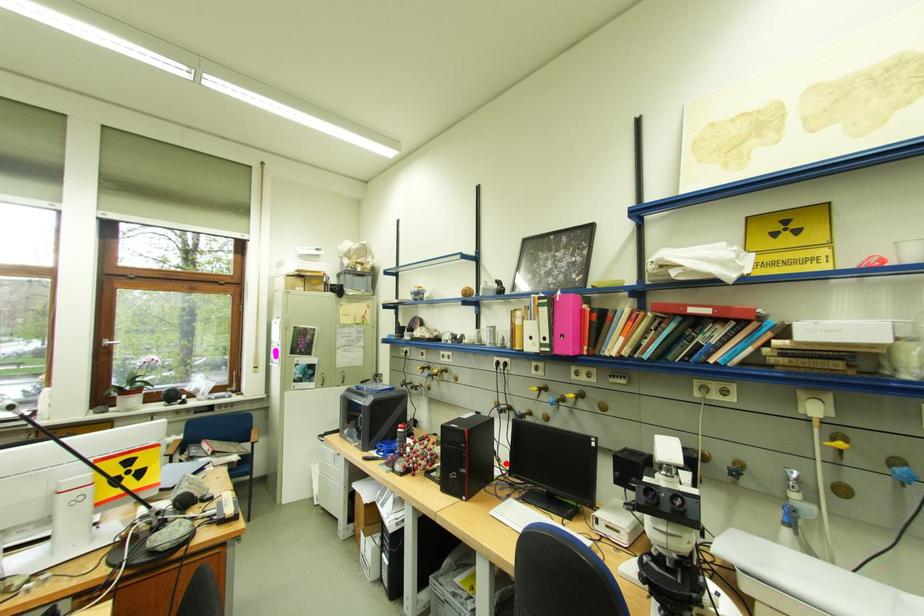
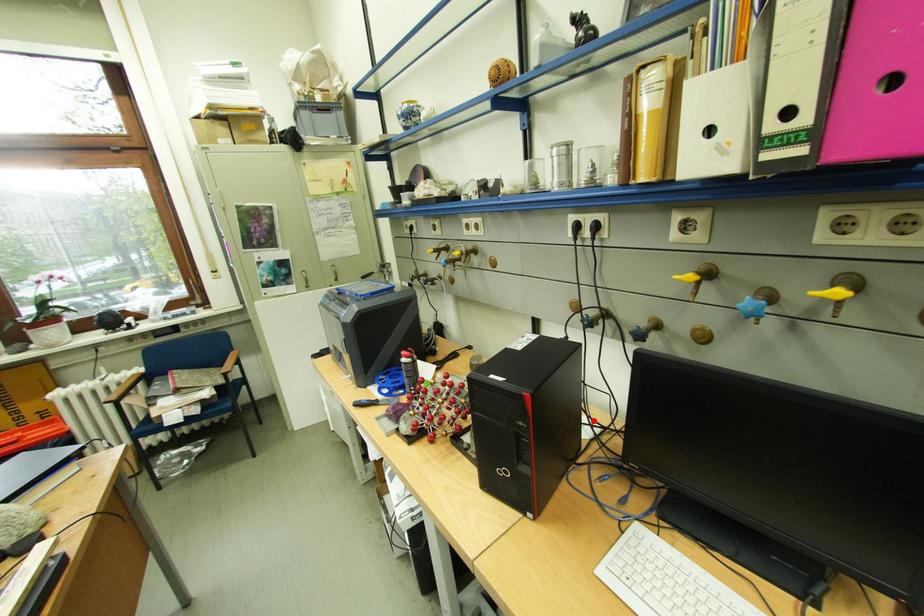
I am providing you with two images of the same scene from different viewpoints. A red point is marked on the first image and another point is marked on the second image. Are the points marked in image1 and image2 representing the same 3D position?

Yes